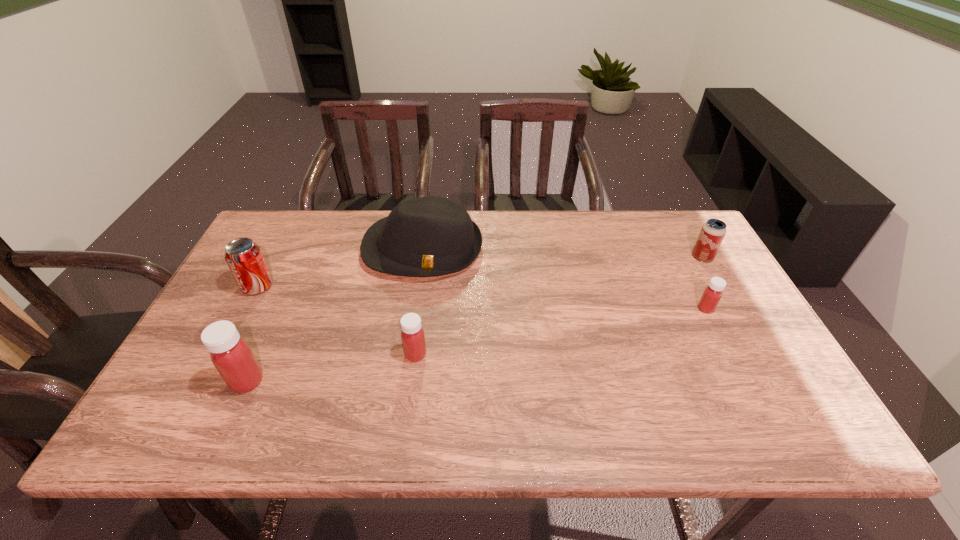
This screenshot has width=960, height=540. I want to click on free spot between the soda can and the shortest medicine, so click(482, 297).

Identify the location of blank region between the leftmost object and the beer can. (480, 272).

Locate an element on the screen. This screenshot has width=960, height=540. unoccupied position between the beer can and the fedora is located at coordinates (563, 253).

I want to click on unoccupied area between the rightmost object and the leftmost object, so click(480, 272).

In order to click on vacant area between the second nearest medicine and the soda can in this screenshot , I will do `click(337, 320)`.

Locate an element on the screen. free point between the second farthest medicine and the nearest medicine is located at coordinates (331, 368).

Find the location of `vacant region between the tallest medicine and the beer can`. vacant region between the tallest medicine and the beer can is located at coordinates (475, 319).

Where is `vacant space in between the rightmost object and the soda can`? vacant space in between the rightmost object and the soda can is located at coordinates (480, 272).

Where is `free space between the beer can and the soda can`? This screenshot has height=540, width=960. free space between the beer can and the soda can is located at coordinates click(480, 272).

This screenshot has height=540, width=960. What are the coordinates of `empty space between the tallest medicine and the fedora` in the screenshot? It's located at (335, 315).